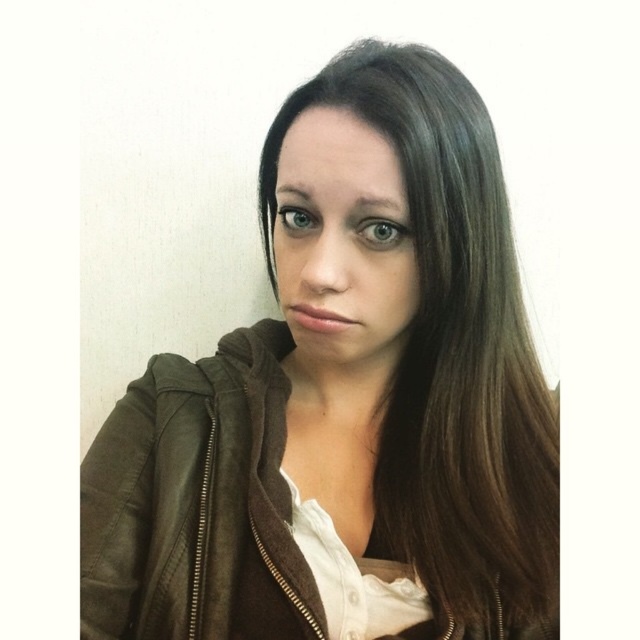
Question: Which point is farther to the camera?

Choices:
 (A) tap(273, 244)
 (B) tap(416, 108)

Answer: (A)

Question: Is leather jacket at center to the left of matte brown hair at center from the viewer's perspective?

Choices:
 (A) yes
 (B) no

Answer: (B)

Question: Among these points, which one is farthest from the camera?

Choices:
 (A) (332, 285)
 (B) (298, 632)

Answer: (B)

Question: Considering the relative positions of leather jacket at center and matte brown hair at center in the image provided, where is leather jacket at center located with respect to matte brown hair at center?

Choices:
 (A) right
 (B) left

Answer: (A)

Question: Does leather jacket at center have a greater width compared to matte brown hair at center?

Choices:
 (A) no
 (B) yes

Answer: (B)